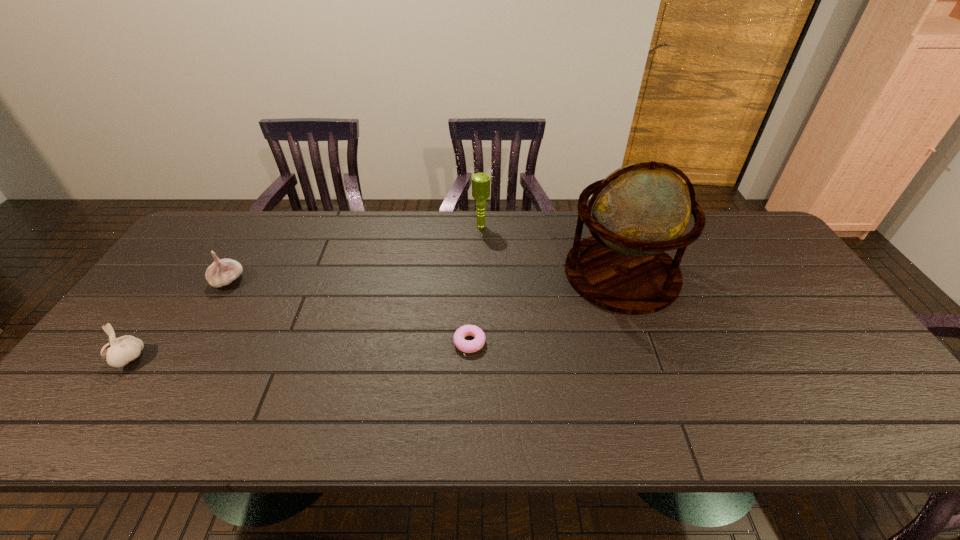
Locate an element on the screen. This screenshot has width=960, height=540. free space located 0.170m on the front-facing side of the globe is located at coordinates click(x=508, y=273).

You are a GUI agent. You are given a task and a screenshot of the screen. Output one action in this format:
    pyautogui.click(x=<x>, y=<y>)
    Task: Click on the blank space located 0.160m on the front-facing side of the globe
    Image resolution: width=960 pixels, height=540 pixels.
    Given the screenshot: What is the action you would take?
    pyautogui.click(x=512, y=273)

This screenshot has height=540, width=960. I want to click on vacant space located 0.080m on the front of the farthest object, so click(481, 247).

Identify the location of vacant space situated 0.140m on the back of the right garlic. (252, 240).

Locate an element on the screen. The height and width of the screenshot is (540, 960). vacant region located 0.130m on the right of the leftmost object is located at coordinates (x=198, y=359).

Where is `vacant region located 0.360m on the back of the doughnut`? The width and height of the screenshot is (960, 540). vacant region located 0.360m on the back of the doughnut is located at coordinates (471, 244).

At what (x,y) coordinates should I click in order to perform the action: click on globe that is at the far edge. Please return your answer as a coordinate pair (x, y). The image size is (960, 540). Looking at the image, I should click on (641, 210).

Where is `microphone positioned at the far edge`? This screenshot has width=960, height=540. microphone positioned at the far edge is located at coordinates (480, 181).

In the image, there is a desktop. Where is `free space at the far edge`? free space at the far edge is located at coordinates (501, 225).

The width and height of the screenshot is (960, 540). I want to click on free space at the near edge, so point(818,410).